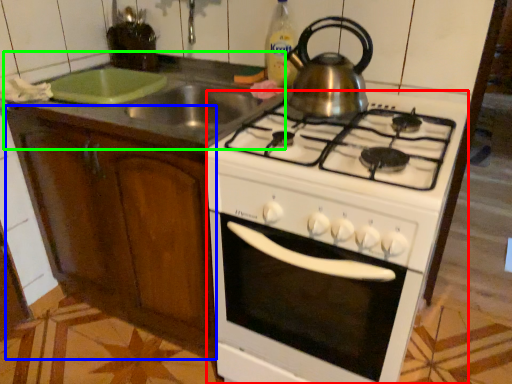
Question: Which object is the closest to the oven (highlighted by a red box)? Choose among these: cabinetry (highlighted by a blue box) or counter top (highlighted by a green box).

Choices:
 (A) cabinetry
 (B) counter top

Answer: (A)